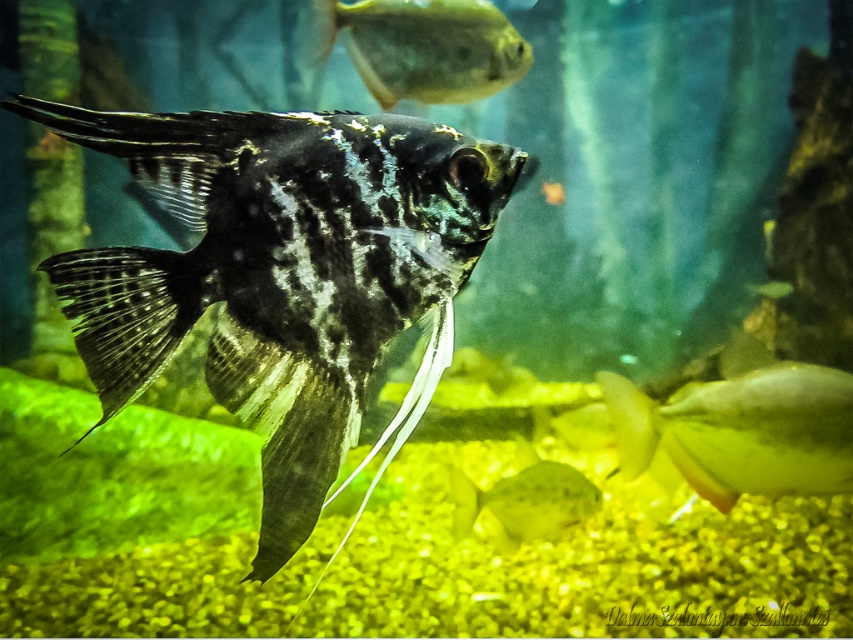
You are an aquarist observing the aquarium. You notice the shiny black fish at center and the shiny yellow fish at lower right. Which fish is positioned higher in the water column?

The shiny black fish at center is positioned higher in the water column than the shiny yellow fish at lower right.

You are an aquarist observing an aquarium. You notice the shiny black fish at center and the shiny yellow fish at lower right. Which fish would cast a bigger shadow if the light is shone directly above them?

The shiny black fish at center is larger in size than the shiny yellow fish at lower right, so it would cast a bigger shadow when light is shone directly above them.

What are the coordinates of the shiny black fish at center in the image?

The shiny black fish at center is located at coordinates point [279,269].